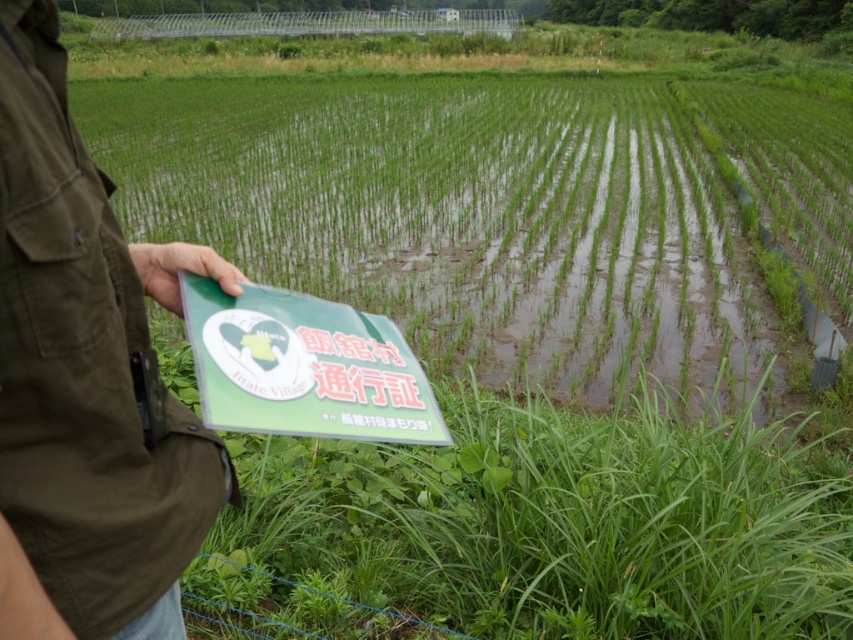
Does green leafy grass at lower center come behind green matte folder at left?

Yes, green leafy grass at lower center is further from the viewer.

Between green leafy grass at lower center and green matte folder at left, which one has more height?

green matte folder at left

Describe the element at coordinates (540, 529) in the screenshot. I see `green leafy grass at lower center` at that location.

Locate an element on the screen. The height and width of the screenshot is (640, 853). green leafy grass at lower center is located at coordinates (540, 529).